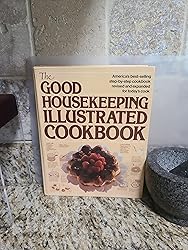
Locate an element on the screen. The height and width of the screenshot is (250, 188). cover of book is located at coordinates (80, 117).